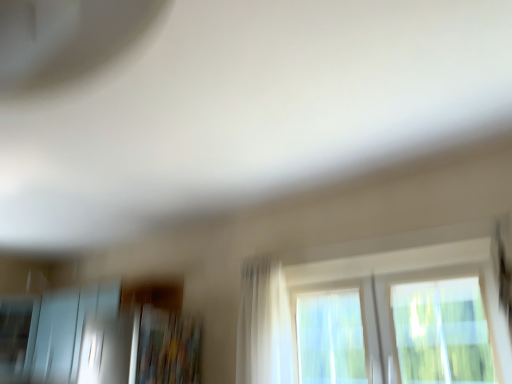
Question: Can you confirm if white sheer curtain at center is shorter than transparent glass window at center?

Choices:
 (A) no
 (B) yes

Answer: (A)

Question: Is white sheer curtain at center wider than transparent glass window at center?

Choices:
 (A) no
 (B) yes

Answer: (B)

Question: Is white sheer curtain at center bigger than transparent glass window at center?

Choices:
 (A) no
 (B) yes

Answer: (A)

Question: Does white sheer curtain at center touch transparent glass window at center?

Choices:
 (A) yes
 (B) no

Answer: (B)

Question: Does white sheer curtain at center appear on the left side of transparent glass window at center?

Choices:
 (A) yes
 (B) no

Answer: (A)

Question: Is white sheer curtain at center located outside transparent glass window at center?

Choices:
 (A) no
 (B) yes

Answer: (B)

Question: Is the position of white sheer curtain at center less distant than that of frosted glass screen door at lower left?

Choices:
 (A) yes
 (B) no

Answer: (A)

Question: Can you confirm if white sheer curtain at center is bigger than frosted glass screen door at lower left?

Choices:
 (A) yes
 (B) no

Answer: (B)

Question: Considering the relative sizes of white sheer curtain at center and frosted glass screen door at lower left in the image provided, is white sheer curtain at center thinner than frosted glass screen door at lower left?

Choices:
 (A) yes
 (B) no

Answer: (A)

Question: From a real-world perspective, does white sheer curtain at center stand above frosted glass screen door at lower left?

Choices:
 (A) no
 (B) yes

Answer: (B)

Question: Is white sheer curtain at center to the right of frosted glass screen door at lower left from the viewer's perspective?

Choices:
 (A) yes
 (B) no

Answer: (A)

Question: Is white sheer curtain at center far away from frosted glass screen door at lower left?

Choices:
 (A) no
 (B) yes

Answer: (B)

Question: From the image's perspective, is frosted glass screen door at lower left on top of white sheer curtain at center?

Choices:
 (A) yes
 (B) no

Answer: (B)